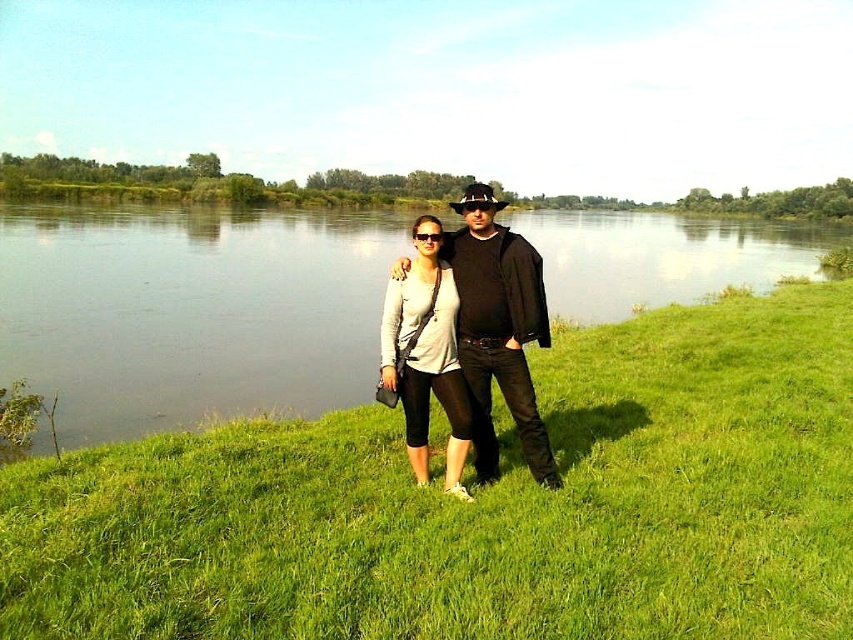
You are standing at the riverside and want to walk towards the two points marked in the image. Which point, point (x=561, y=612) or point (x=566, y=248), will you reach first?

Point (x=561, y=612) is closer to the viewer than point (x=566, y=248), so you will reach point (x=561, y=612) first.

You are standing at the point labeled point (456, 268) and want to walk to the riverbank. There is an obstacle at point (444, 381). Can you walk around the obstacle to reach the riverbank safely?

Point (456, 268) is behind point (444, 381), so you can walk around the obstacle at point (444, 381) to reach the riverbank safely.